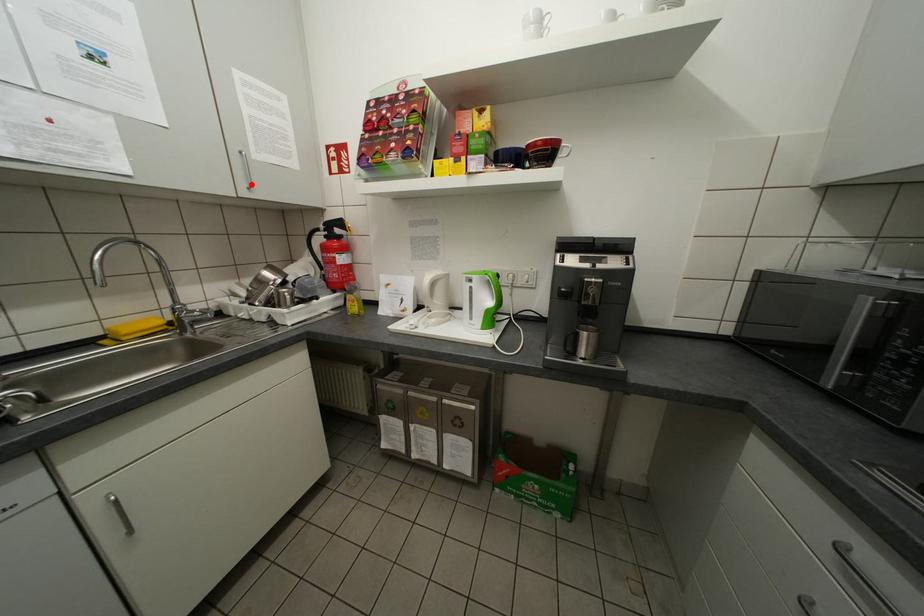
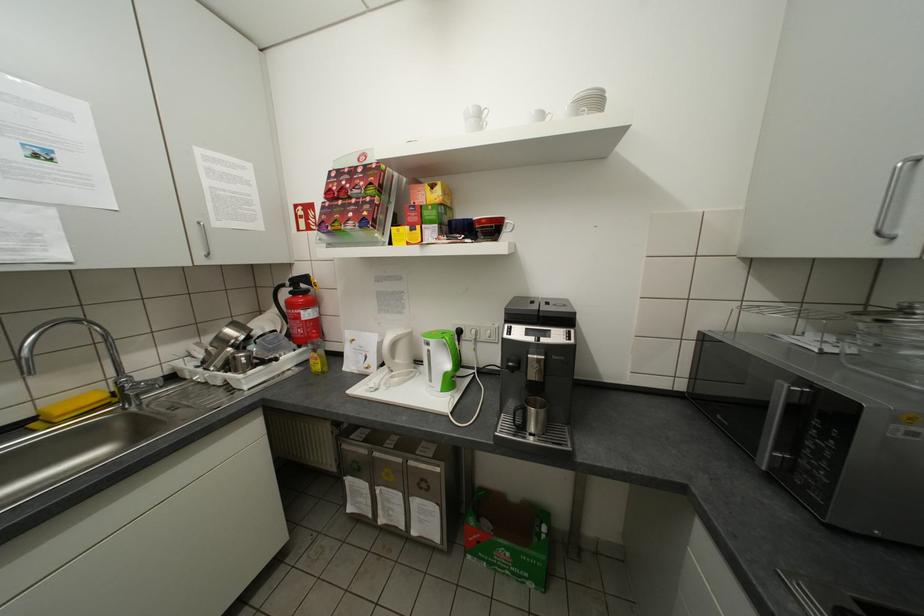
Where in the second image is the point corresponding to the highlighted location from the first image?

(209, 253)